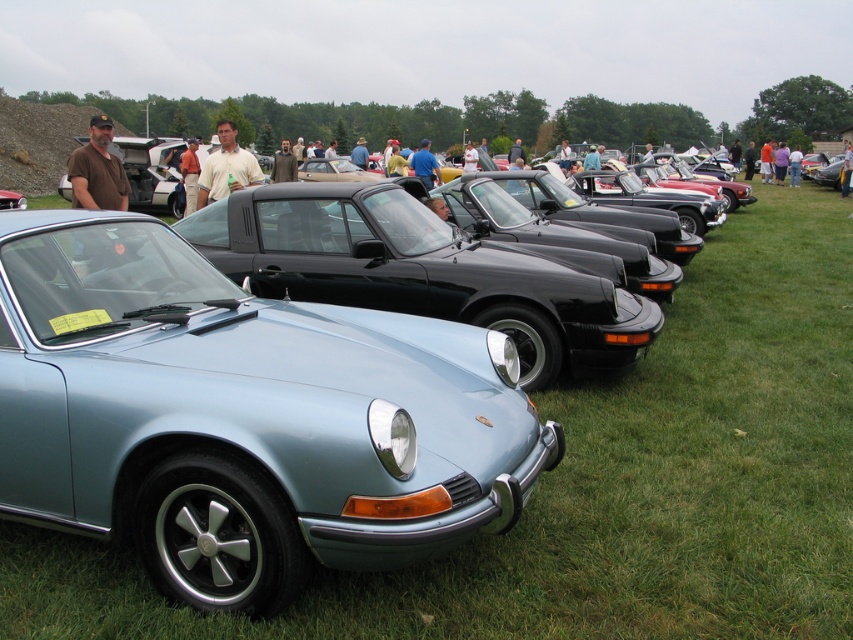
Question: Which of the following is the farthest from the observer?

Choices:
 (A) (178, 160)
 (B) (109, 202)

Answer: (A)

Question: Is the position of brown cap at upper left less distant than that of orange cotton shirt at center?

Choices:
 (A) yes
 (B) no

Answer: (A)

Question: Which of the following is the farthest from the observer?

Choices:
 (A) orange cotton shirt at center
 (B) brown cap at upper left
 (C) matte white shirt at center

Answer: (A)

Question: Can you confirm if brown cap at upper left is thinner than orange cotton shirt at center?

Choices:
 (A) no
 (B) yes

Answer: (A)

Question: Can you confirm if brown cap at upper left is thinner than orange cotton shirt at center?

Choices:
 (A) no
 (B) yes

Answer: (A)

Question: Considering the real-world distances, which object is closest to the matte white shirt at center?

Choices:
 (A) orange cotton shirt at center
 (B) brown cap at upper left

Answer: (A)